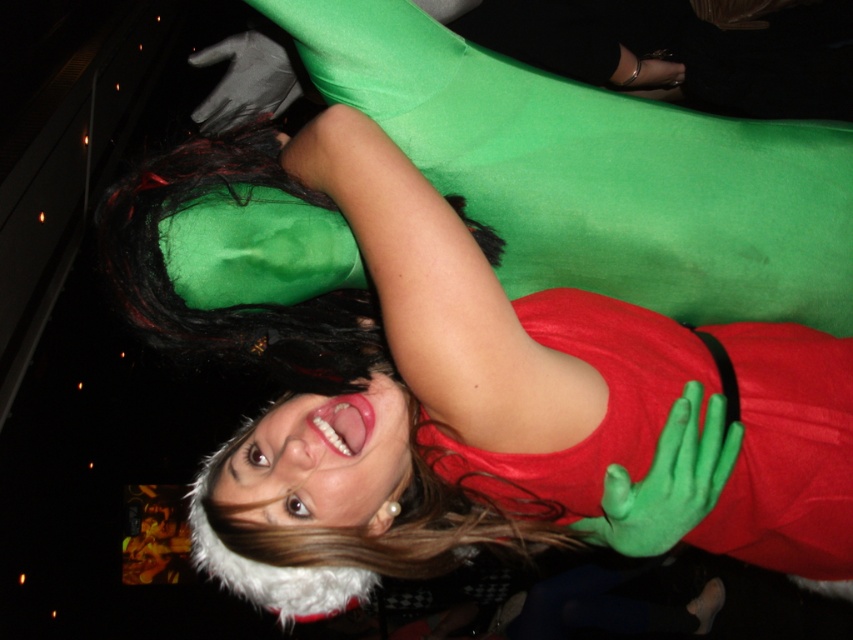
Is matte green gloves at upper center thinner than green matte gloves at upper center?

No, matte green gloves at upper center is not thinner than green matte gloves at upper center.

From the picture: Who is more distant from viewer, (468, 355) or (799, 493)?

Positioned behind is point (799, 493).

Find the location of a particular element. This screenshot has height=640, width=853. matte green gloves at upper center is located at coordinates (405, 353).